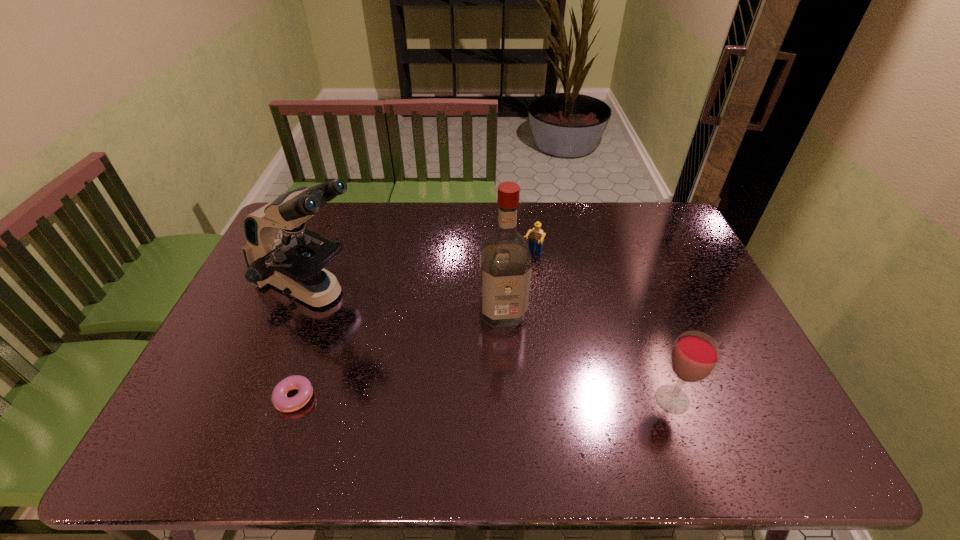
Identify the location of object that is positioned at the left edge. (280, 251).

The height and width of the screenshot is (540, 960). I want to click on free space at the far edge, so click(552, 210).

The image size is (960, 540). What are the coordinates of `vacant space at the near edge of the desktop` in the screenshot? It's located at (468, 400).

At what (x,y) coordinates should I click in order to perform the action: click on vacant space at the right edge of the desktop. Please return your answer as a coordinate pair (x, y). Looking at the image, I should click on (684, 275).

The width and height of the screenshot is (960, 540). I want to click on vacant space at the far left corner of the desktop, so click(314, 226).

The width and height of the screenshot is (960, 540). I want to click on vacant space at the near left corner of the desktop, so click(238, 392).

This screenshot has width=960, height=540. In order to click on vacant region at the near right corner of the desktop in this screenshot , I will do `click(757, 402)`.

Locate an element on the screen. This screenshot has height=540, width=960. empty space that is in between the microscope and the Lego is located at coordinates (423, 273).

Where is `free spot between the fourth object from left to right and the shortest object`? free spot between the fourth object from left to right and the shortest object is located at coordinates (413, 327).

Find the location of a particular element. vacant area that lies between the wineglass and the Lego is located at coordinates (602, 327).